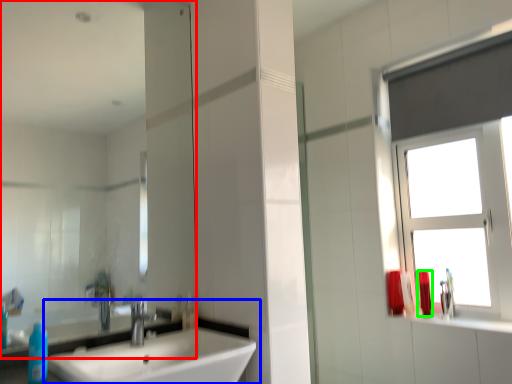
Question: Considering the real-world distances, which object is closest to mirror (highlighted by a red box)? sink (highlighted by a blue box) or toiletry (highlighted by a green box).

Choices:
 (A) sink
 (B) toiletry

Answer: (A)